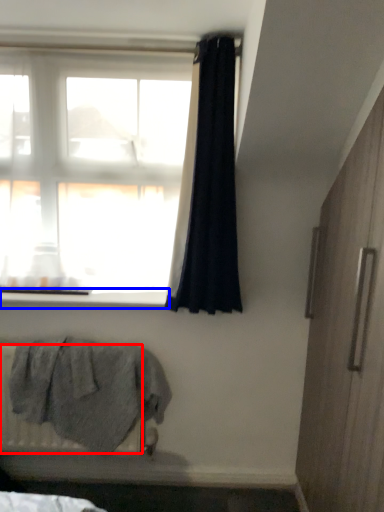
Question: Which object appears farthest to the camera in this image, radiator (highlighted by a red box) or window sill (highlighted by a blue box)?

Choices:
 (A) radiator
 (B) window sill

Answer: (B)